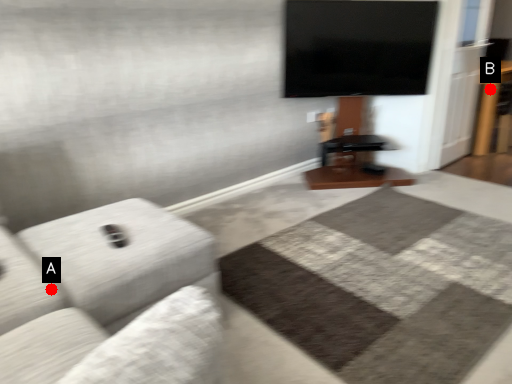
Question: Two points are circled on the image, labeled by A and B beside each circle. Which point appears closest to the camera in this image?

Choices:
 (A) A is closer
 (B) B is closer

Answer: (A)